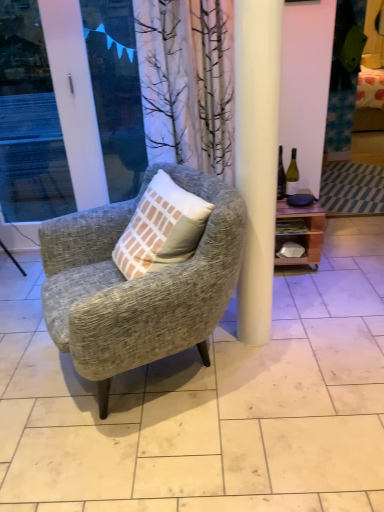
Image resolution: width=384 pixels, height=512 pixels. What do you see at coordinates (137, 284) in the screenshot? I see `textured gray armchair at center` at bounding box center [137, 284].

What do you see at coordinates (292, 175) in the screenshot? I see `green glass bottle at right` at bounding box center [292, 175].

The height and width of the screenshot is (512, 384). Describe the element at coordinates (299, 232) in the screenshot. I see `wooden shelf at right` at that location.

This screenshot has width=384, height=512. In order to click on textured gray armchair at center in this screenshot , I will do `click(137, 284)`.

Which is nearer, (286,207) or (168,336)?

Positioned in front is point (168,336).

Which of these two, wooden shelf at right or textured gray armchair at center, stands taller?

Standing taller between the two is textured gray armchair at center.

From a real-world perspective, is wooden shelf at right physically below textured gray armchair at center?

Yes, from a real-world perspective, wooden shelf at right is under textured gray armchair at center.

You are a GUI agent. You are given a task and a screenshot of the screen. Output one action in this format:
    pyautogui.click(x=<x>, y=<y>)
    Task: Click on the bottle above the wooden shelf at right (from the image's perspective)
    Image resolution: width=384 pixels, height=512 pixels.
    Given the screenshot: What is the action you would take?
    pyautogui.click(x=292, y=175)

Is green glass bottle at right facing away from wooden shelf at right?

No, green glass bottle at right is not facing the opposite direction of wooden shelf at right.

From a real-world perspective, is green glass bottle at right located beneath wooden shelf at right?

Actually, green glass bottle at right is physically above wooden shelf at right in the real world.

Is green glass bottle at right taller than wooden shelf at right?

Incorrect, the height of green glass bottle at right is not larger of that of wooden shelf at right.

Could you tell me if green glass bottle at right is facing textured gray armchair at center?

No.

Is green glass bottle at right smaller than textured gray armchair at center?

Correct, green glass bottle at right occupies less space than textured gray armchair at center.

How different are the orientations of green glass bottle at right and textured gray armchair at center in degrees?

The facing directions of green glass bottle at right and textured gray armchair at center are 68.4 degrees apart.

In the scene shown: Is there a large distance between green glass bottle at right and textured gray armchair at center?

Yes, green glass bottle at right and textured gray armchair at center are located far from each other.

Does wooden shelf at right have a larger size compared to green glass bottle at right?

Correct, wooden shelf at right is larger in size than green glass bottle at right.

Which object is closer to the camera, wooden shelf at right or green glass bottle at right?

wooden shelf at right is more forward.

In the image, is textured gray armchair at center positioned in front of or behind green glass bottle at right?

Clearly, textured gray armchair at center is in front of green glass bottle at right.

Consider the image. Is textured gray armchair at center to the left of green glass bottle at right from the viewer's perspective?

Yes, textured gray armchair at center is to the left of green glass bottle at right.

From the picture: Between textured gray armchair at center and green glass bottle at right, which one has less height?

green glass bottle at right.

Identify the location of bottle above the textured gray armchair at center (from a real-world perspective). (292, 175).

Considering the relative sizes of textured gray armchair at center and wooden shelf at right in the image provided, is textured gray armchair at center thinner than wooden shelf at right?

Incorrect, the width of textured gray armchair at center is not less than that of wooden shelf at right.

Does point (228, 286) lie in front of point (308, 230)?

Yes, point (228, 286) is in front of point (308, 230).

Does textured gray armchair at center have a smaller size compared to wooden shelf at right?

No, textured gray armchair at center is not smaller than wooden shelf at right.

Considering the relative sizes of textured gray armchair at center and wooden shelf at right in the image provided, is textured gray armchair at center taller than wooden shelf at right?

Correct, textured gray armchair at center is much taller as wooden shelf at right.

From a real-world perspective, who is located lower, white glossy screen door at left or green glass bottle at right?

green glass bottle at right is physically lower.

The image size is (384, 512). I want to click on screen door located above the green glass bottle at right (from a real-world perspective), so pyautogui.click(x=29, y=122).

Consider the image. How many degrees apart are the facing directions of white glossy screen door at left and green glass bottle at right?

There is a 0.091-degree angle between the facing directions of white glossy screen door at left and green glass bottle at right.

Is white glossy screen door at left looking in the opposite direction of green glass bottle at right?

No, green glass bottle at right is not at the back of white glossy screen door at left.

This screenshot has width=384, height=512. Find the location of `chair below the wooden shelf at right (from the image's perspective)`. chair below the wooden shelf at right (from the image's perspective) is located at coordinates (137, 284).

Where is `bottle behind the wooden shelf at right`? bottle behind the wooden shelf at right is located at coordinates (292, 175).

In the scene shown: Which object lies further to the anchor point green glass bottle at right, textured gray armchair at center or white glossy screen door at left?

The object further to green glass bottle at right is white glossy screen door at left.

Which object lies nearer to the anchor point white glossy screen door at left, wooden shelf at right or green glass bottle at right?

wooden shelf at right is closer to white glossy screen door at left.

Looking at this image, considering their positions, is wooden shelf at right positioned further to textured gray armchair at center than white glossy screen door at left?

white glossy screen door at left.

Looking at the image, which one is located closer to textured gray armchair at center, white glossy screen door at left or green glass bottle at right?

green glass bottle at right is closer to textured gray armchair at center.

Looking at the image, which one is located further to green glass bottle at right, wooden shelf at right or white glossy screen door at left?

white glossy screen door at left lies further to green glass bottle at right than the other object.

Estimate the real-world distances between objects in this image. Which object is further from green glass bottle at right, wooden shelf at right or textured gray armchair at center?

Based on the image, textured gray armchair at center appears to be further to green glass bottle at right.

Based on their spatial positions, is textured gray armchair at center or wooden shelf at right further from white glossy screen door at left?

wooden shelf at right.

Estimate the real-world distances between objects in this image. Which object is closer to textured gray armchair at center, green glass bottle at right or white glossy screen door at left?

green glass bottle at right lies closer to textured gray armchair at center than the other object.

The width and height of the screenshot is (384, 512). I want to click on bottle between white glossy screen door at left and wooden shelf at right in the horizontal direction, so click(292, 175).

Where is `chair between white glossy screen door at left and wooden shelf at right`? chair between white glossy screen door at left and wooden shelf at right is located at coordinates (137, 284).

Where is `chair between white glossy screen door at left and green glass bottle at right from left to right`? The image size is (384, 512). chair between white glossy screen door at left and green glass bottle at right from left to right is located at coordinates (137, 284).

Find the location of a particular element. shelf between textured gray armchair at center and green glass bottle at right from front to back is located at coordinates (299, 232).